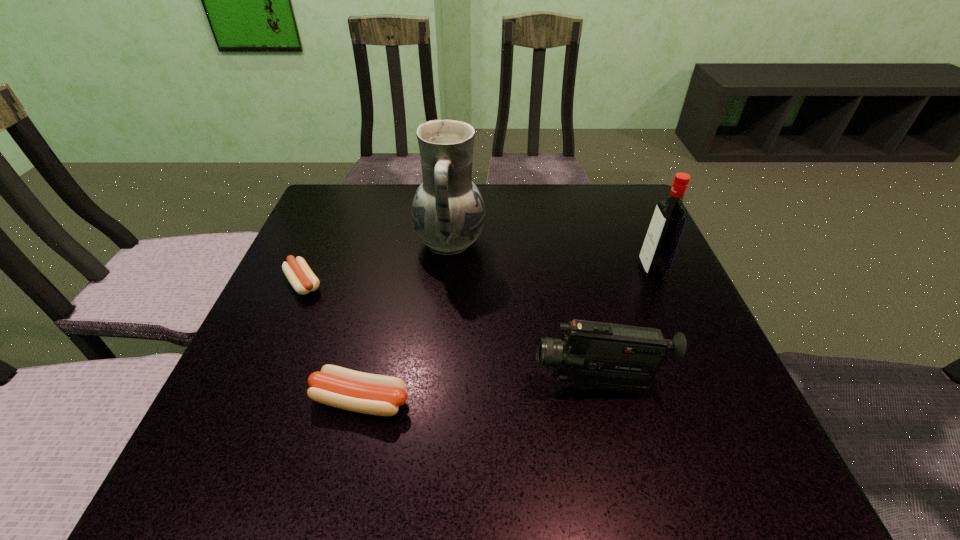
Identify the location of camcorder that is at the right edge. (600, 355).

Where is `vacant space at the far edge of the desktop`? This screenshot has height=540, width=960. vacant space at the far edge of the desktop is located at coordinates (382, 227).

Locate an element on the screen. The width and height of the screenshot is (960, 540). vacant point at the near edge is located at coordinates coord(624,444).

This screenshot has height=540, width=960. In the image, there is a desktop. Identify the location of vacant space at the left edge. (250, 374).

Find the location of a particular element. vacant space at the right edge of the desktop is located at coordinates (660, 296).

The height and width of the screenshot is (540, 960). In the image, there is a desktop. Find the location of `free space at the far left corner`. free space at the far left corner is located at coordinates (368, 226).

This screenshot has height=540, width=960. In order to click on vacant region at the far right corner of the desktop in this screenshot , I will do coord(586,189).

At what (x,y) coordinates should I click in order to perform the action: click on free space at the near right corner of the desktop. Please return your answer as a coordinate pair (x, y). The image size is (960, 540). Looking at the image, I should click on (673, 485).

Locate an element on the screen. free space between the farther sausage and the pitcher is located at coordinates (377, 264).

Identify the location of empty space that is in between the fourth tallest object and the third shortest object. This screenshot has width=960, height=540. (479, 393).